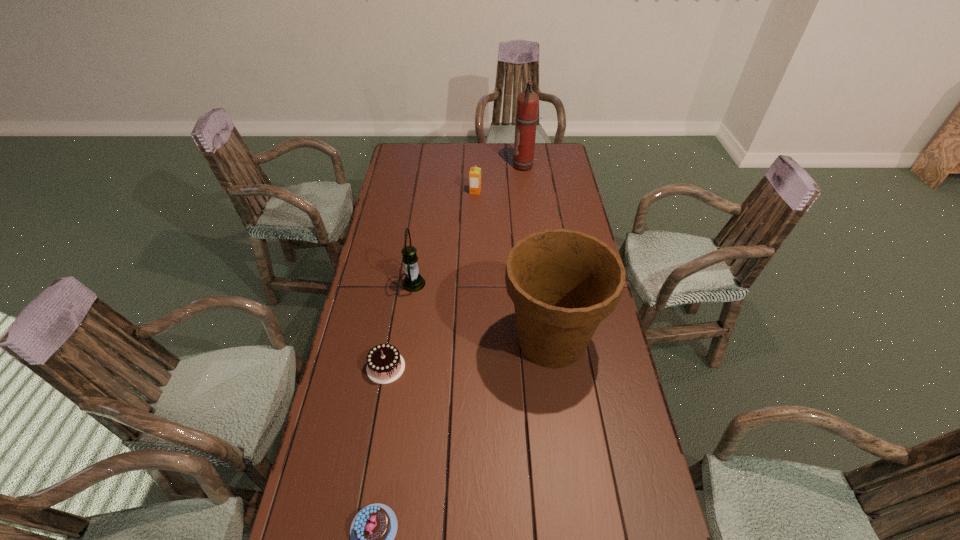
Locate an element on the screen. Image resolution: width=960 pixels, height=540 pixels. free area in between the farther chocolate cake and the tallest object is located at coordinates (455, 267).

Identify the location of free space between the second shortest object and the orange juice. The height and width of the screenshot is (540, 960). (431, 280).

Identify which object is the second closest to the fourth tallest object. Please provide its 2D coordinates. Your answer should be formatted as a tuple, i.e. [(x, y)], where the tuple contains the x and y coordinates of a point satisfying the conditions above.

[(413, 281)]

Find the location of a particular element. The width and height of the screenshot is (960, 540). object that is the fifth closest one to the nearer chocolate cake is located at coordinates (527, 101).

Image resolution: width=960 pixels, height=540 pixels. Identify the location of free space that satisfies the following two spatial constraints: 1. on the side where the fourth nearest object emits light; 2. on the right side of the flowerpot. (406, 340).

At what (x,y) coordinates should I click in order to perform the action: click on vacant area that satisfies the following two spatial constraints: 1. on the back side of the flowerpot; 2. on the side where the fourth nearest object emits light. Please return your answer as a coordinate pair (x, y). Image resolution: width=960 pixels, height=540 pixels. Looking at the image, I should click on (543, 284).

The height and width of the screenshot is (540, 960). What are the coordinates of `free space that satisfies the following two spatial constraints: 1. on the front side of the third shortest object; 2. on the side where the fourth shortest object emits light` in the screenshot? It's located at (474, 284).

Image resolution: width=960 pixels, height=540 pixels. I want to click on free spot that satisfies the following two spatial constraints: 1. on the side where the fourth nearest object emits light; 2. on the back side of the flowerpot, so tap(406, 340).